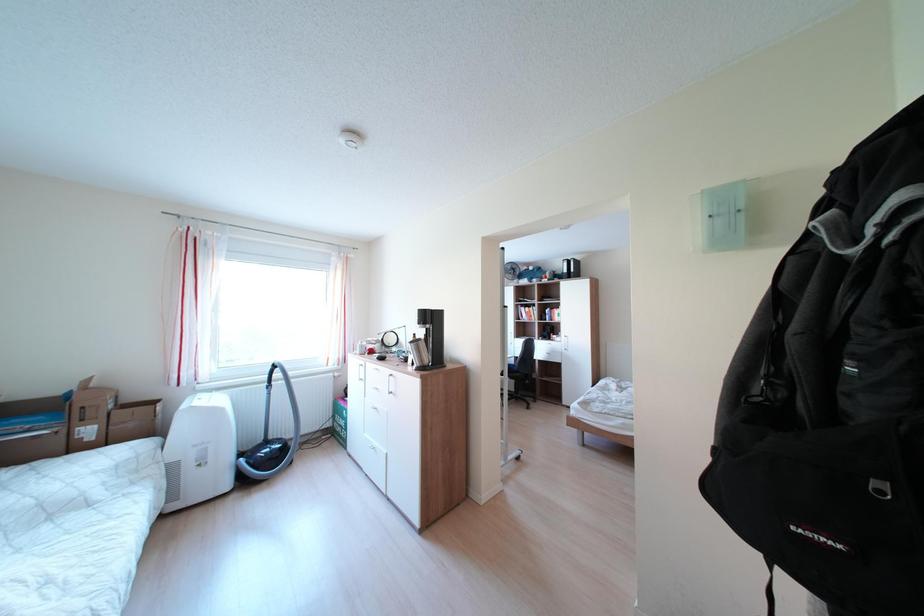
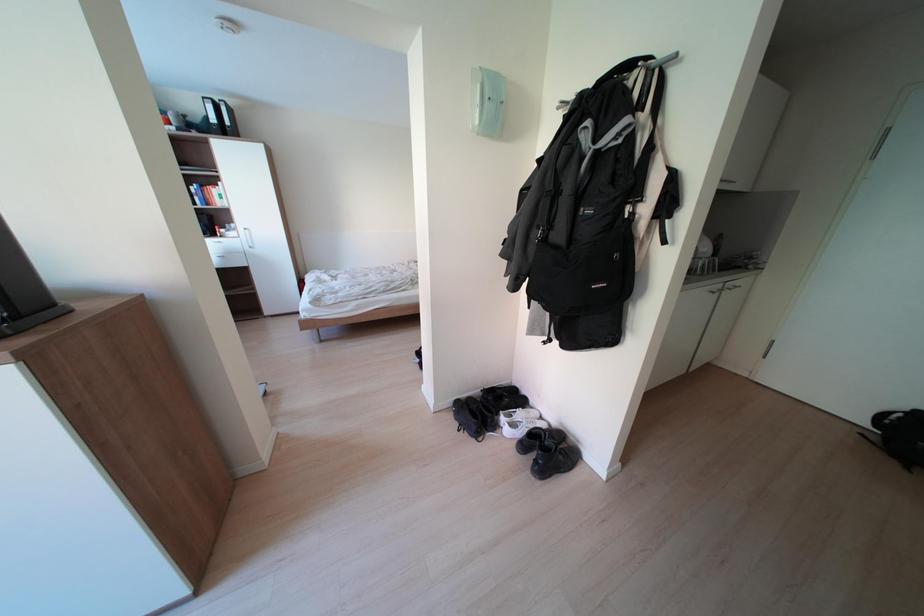
The first image is from the beginning of the video and the second image is from the end. How did the camera likely rotate when shooting the video?

The camera's rotation is toward right-down.